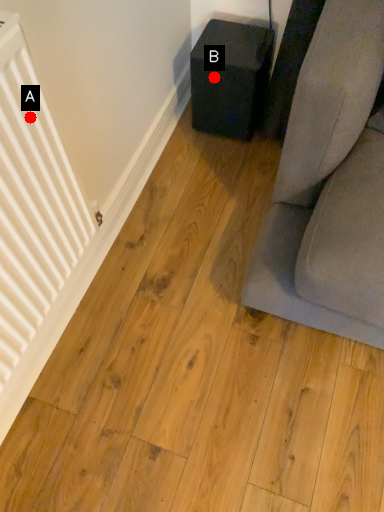
Question: Two points are circled on the image, labeled by A and B beside each circle. Which of the following is the farthest from the observer?

Choices:
 (A) A is further
 (B) B is further

Answer: (B)